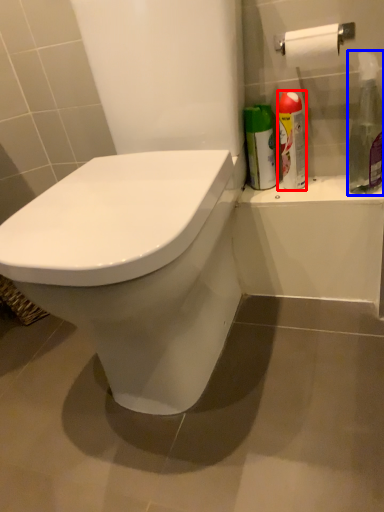
Question: Which point is further to the camera, cleaning product (highlighted by a red box) or cleaning product (highlighted by a blue box)?

Choices:
 (A) cleaning product
 (B) cleaning product

Answer: (A)